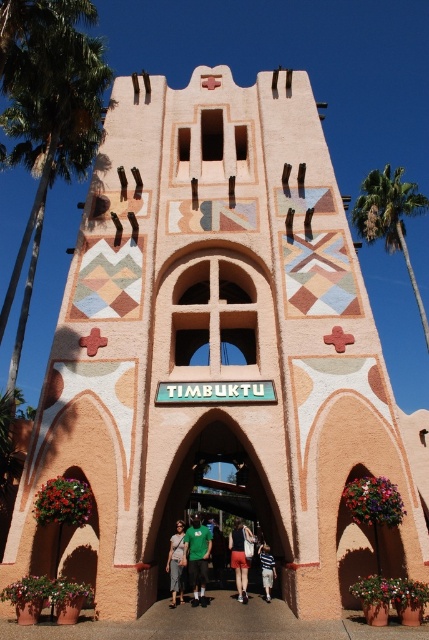
Can you confirm if denim shorts at center is positioned below light blue denim shorts at center?

No, denim shorts at center is not below light blue denim shorts at center.

Can you confirm if denim shorts at center is taller than light blue denim shorts at center?

Yes, denim shorts at center is taller than light blue denim shorts at center.

Between point (181, 570) and point (260, 557), which one is positioned in front?

Point (181, 570)

Locate an element on the screen. This screenshot has height=640, width=429. denim shorts at center is located at coordinates (175, 563).

Is green leafy palm tree at upper right below light blue denim shorts at center?

No.

Is point (389, 220) positioned behind point (265, 568)?

Yes, point (389, 220) is farther from viewer.

Between point (365, 184) and point (271, 577), which one is positioned in front?

Point (271, 577) is more forward.

Identify the location of green leafy palm tree at upper right. (390, 218).

Consider the image. Does green leafy palm tree at left appear on the right side of denim shorts at center?

Incorrect, green leafy palm tree at left is not on the right side of denim shorts at center.

Who is higher up, green leafy palm tree at left or denim shorts at center?

green leafy palm tree at left is above.

Is point (2, 120) less distant than point (178, 538)?

No, (2, 120) is further to viewer.

Find the location of a particular element. This screenshot has width=429, height=640. green leafy palm tree at left is located at coordinates (51, 145).